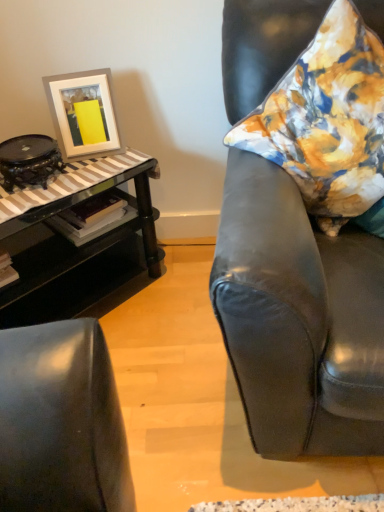
Identify the location of free space above black glass table at left (from a real-world perspective). This screenshot has width=384, height=512. (71, 177).